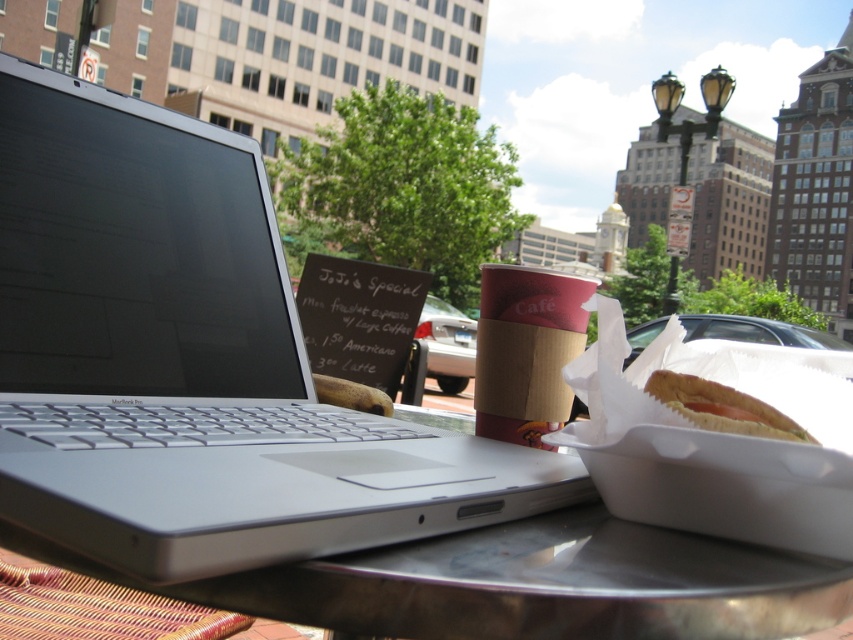
You are standing at the entrance of the outdoor cafe and want to find the metallic silver table at center. According to the coordinates provided, where should you look to locate it?

The metallic silver table at center is located at coordinates point (526, 584), so you should look towards that coordinate position to find it.

From the picture: You are a customer at the outdoor table and want to place your silver metallic laptop at center on the metallic silver table at center. Is there enough space to the right of the laptop to place your coffee cup?

The silver metallic laptop at center is positioned on the left side of the metallic silver table at center, so there is sufficient space to the right of the laptop to place the coffee cup.